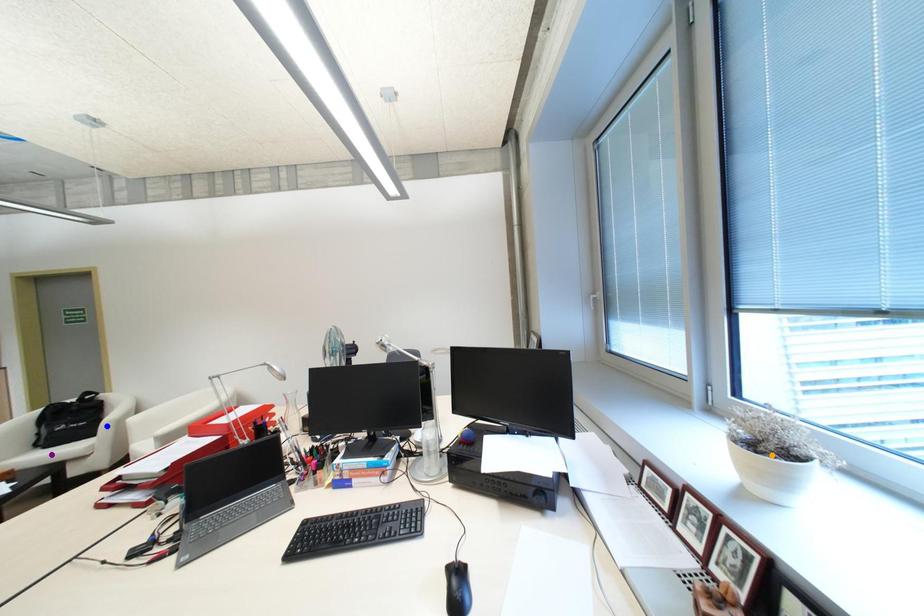
From the picture: Order these from farthest to nearest:
purple point
orange point
blue point

blue point, purple point, orange point